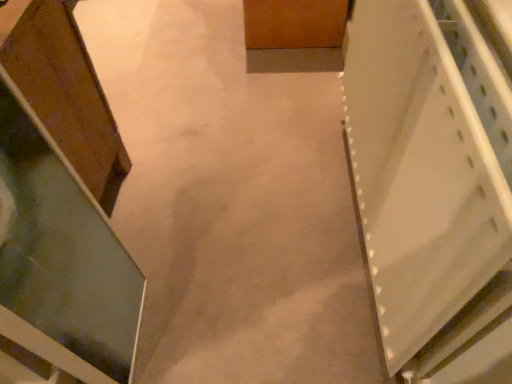
The height and width of the screenshot is (384, 512). Describe the element at coordinates (67, 94) in the screenshot. I see `wooden cabinet at left, the first cabinetry positioned from the left` at that location.

Where is `wooden cabinet at left, which is the 2th cabinetry in right-to-left order`? wooden cabinet at left, which is the 2th cabinetry in right-to-left order is located at coordinates (67, 94).

Locate an element on the screen. The height and width of the screenshot is (384, 512). white plastic shelf at right, which ranks as the second cabinetry in left-to-right order is located at coordinates (429, 176).

The width and height of the screenshot is (512, 384). What do you see at coordinates (429, 176) in the screenshot?
I see `white plastic shelf at right, the first cabinetry in the right-to-left sequence` at bounding box center [429, 176].

Where is `wooden cabinet at left, which is the 2th cabinetry in right-to-left order`? The width and height of the screenshot is (512, 384). wooden cabinet at left, which is the 2th cabinetry in right-to-left order is located at coordinates (67, 94).

Which object is positioned more to the left, wooden cabinet at left, the first cabinetry positioned from the left, or white plastic shelf at right, which ranks as the second cabinetry in left-to-right order?

From the viewer's perspective, wooden cabinet at left, the first cabinetry positioned from the left, appears more on the left side.

Considering their positions, is wooden cabinet at left, the first cabinetry positioned from the left, located in front of or behind white plastic shelf at right, the first cabinetry in the right-to-left sequence?

Clearly, wooden cabinet at left, the first cabinetry positioned from the left, is behind white plastic shelf at right, the first cabinetry in the right-to-left sequence.

Considering the points (91, 135) and (450, 357), which point is behind, point (91, 135) or point (450, 357)?

The point (91, 135) is behind.

From the image's perspective, is wooden cabinet at left, which is the 2th cabinetry in right-to-left order, below white plastic shelf at right, which ranks as the second cabinetry in left-to-right order?

Actually, wooden cabinet at left, which is the 2th cabinetry in right-to-left order, appears above white plastic shelf at right, which ranks as the second cabinetry in left-to-right order, in the image.

From a real-world perspective, between wooden cabinet at left, the first cabinetry positioned from the left, and white plastic shelf at right, which ranks as the second cabinetry in left-to-right order, who is vertically higher?

From a 3D spatial view, white plastic shelf at right, which ranks as the second cabinetry in left-to-right order, is above.

Which of these two, wooden cabinet at left, the first cabinetry positioned from the left, or white plastic shelf at right, the first cabinetry in the right-to-left sequence, is thinner?

Thinner between the two is white plastic shelf at right, the first cabinetry in the right-to-left sequence.

Can you confirm if wooden cabinet at left, the first cabinetry positioned from the left, is taller than white plastic shelf at right, the first cabinetry in the right-to-left sequence?

Correct, wooden cabinet at left, the first cabinetry positioned from the left, is much taller as white plastic shelf at right, the first cabinetry in the right-to-left sequence.

Can you confirm if wooden cabinet at left, the first cabinetry positioned from the left, is smaller than white plastic shelf at right, the first cabinetry in the right-to-left sequence?

No.

Is wooden cabinet at left, which is the 2th cabinetry in right-to-left order, located outside white plastic shelf at right, the first cabinetry in the right-to-left sequence?

Indeed, wooden cabinet at left, which is the 2th cabinetry in right-to-left order, is completely outside white plastic shelf at right, the first cabinetry in the right-to-left sequence.

Is wooden cabinet at left, the first cabinetry positioned from the left, not close to white plastic shelf at right, which ranks as the second cabinetry in left-to-right order?

No.

Could you tell me if wooden cabinet at left, the first cabinetry positioned from the left, is facing white plastic shelf at right, which ranks as the second cabinetry in left-to-right order?

No, wooden cabinet at left, the first cabinetry positioned from the left, is not turned towards white plastic shelf at right, which ranks as the second cabinetry in left-to-right order.

What's the angular difference between wooden cabinet at left, which is the 2th cabinetry in right-to-left order, and white plastic shelf at right, the first cabinetry in the right-to-left sequence,'s facing directions?

They differ by 91.8 degrees in their facing directions.

Find the location of a particular element. cabinetry below the wooden cabinet at left, which is the 2th cabinetry in right-to-left order (from the image's perspective) is located at coordinates (429, 176).

Which object is positioned more to the right, white plastic shelf at right, which ranks as the second cabinetry in left-to-right order, or wooden cabinet at left, the first cabinetry positioned from the left?

Positioned to the right is white plastic shelf at right, which ranks as the second cabinetry in left-to-right order.

In the scene shown: Considering the positions of objects white plastic shelf at right, the first cabinetry in the right-to-left sequence, and wooden cabinet at left, which is the 2th cabinetry in right-to-left order, in the image provided, who is in front, white plastic shelf at right, the first cabinetry in the right-to-left sequence, or wooden cabinet at left, which is the 2th cabinetry in right-to-left order,?

Positioned in front is white plastic shelf at right, the first cabinetry in the right-to-left sequence.

Is point (406, 159) less distant than point (99, 99)?

Yes, it is in front of point (99, 99).

From the image's perspective, does white plastic shelf at right, the first cabinetry in the right-to-left sequence, appear lower than wooden cabinet at left, which is the 2th cabinetry in right-to-left order?

Correct, white plastic shelf at right, the first cabinetry in the right-to-left sequence, appears lower than wooden cabinet at left, which is the 2th cabinetry in right-to-left order, in the image.

Consider the image. From a real-world perspective, is white plastic shelf at right, which ranks as the second cabinetry in left-to-right order, positioned under wooden cabinet at left, which is the 2th cabinetry in right-to-left order, based on gravity?

Incorrect, from a real-world perspective, white plastic shelf at right, which ranks as the second cabinetry in left-to-right order, is higher than wooden cabinet at left, which is the 2th cabinetry in right-to-left order.

Does white plastic shelf at right, which ranks as the second cabinetry in left-to-right order, have a lesser width compared to wooden cabinet at left, the first cabinetry positioned from the left?

Indeed, white plastic shelf at right, which ranks as the second cabinetry in left-to-right order, has a lesser width compared to wooden cabinet at left, the first cabinetry positioned from the left.

Between white plastic shelf at right, the first cabinetry in the right-to-left sequence, and wooden cabinet at left, which is the 2th cabinetry in right-to-left order, which one has less height?

Standing shorter between the two is white plastic shelf at right, the first cabinetry in the right-to-left sequence.

Can you confirm if white plastic shelf at right, the first cabinetry in the right-to-left sequence, is bigger than wooden cabinet at left, which is the 2th cabinetry in right-to-left order?

Incorrect, white plastic shelf at right, the first cabinetry in the right-to-left sequence, is not larger than wooden cabinet at left, which is the 2th cabinetry in right-to-left order.

Based on the photo, could wooden cabinet at left, which is the 2th cabinetry in right-to-left order, be considered to be inside white plastic shelf at right, the first cabinetry in the right-to-left sequence?

No, wooden cabinet at left, which is the 2th cabinetry in right-to-left order, is located outside of white plastic shelf at right, the first cabinetry in the right-to-left sequence.

Is white plastic shelf at right, which ranks as the second cabinetry in left-to-right order, with wooden cabinet at left, which is the 2th cabinetry in right-to-left order?

Answer: white plastic shelf at right, which ranks as the second cabinetry in left-to-right order, is not next to wooden cabinet at left, which is the 2th cabinetry in right-to-left order, and they're not touching.

Is white plastic shelf at right, which ranks as the second cabinetry in left-to-right order, facing away from wooden cabinet at left, the first cabinetry positioned from the left?

No, white plastic shelf at right, which ranks as the second cabinetry in left-to-right order, is not facing away from wooden cabinet at left, the first cabinetry positioned from the left.

Can you tell me how much white plastic shelf at right, the first cabinetry in the right-to-left sequence, and wooden cabinet at left, which is the 2th cabinetry in right-to-left order, differ in facing direction?

The angle between the facing direction of white plastic shelf at right, the first cabinetry in the right-to-left sequence, and the facing direction of wooden cabinet at left, which is the 2th cabinetry in right-to-left order, is 91.8 degrees.

Measure the distance from white plastic shelf at right, the first cabinetry in the right-to-left sequence, to wooden cabinet at left, which is the 2th cabinetry in right-to-left order.

They are 29.85 inches apart.

The image size is (512, 384). Find the location of `cabinetry that appears on the right of wooden cabinet at left, which is the 2th cabinetry in right-to-left order`. cabinetry that appears on the right of wooden cabinet at left, which is the 2th cabinetry in right-to-left order is located at coordinates pos(429,176).

Find the location of a particular element. The height and width of the screenshot is (384, 512). cabinetry located above the wooden cabinet at left, the first cabinetry positioned from the left (from a real-world perspective) is located at coordinates (429, 176).

Locate an element on the screen. The width and height of the screenshot is (512, 384). cabinetry below the white plastic shelf at right, the first cabinetry in the right-to-left sequence (from a real-world perspective) is located at coordinates (67, 94).